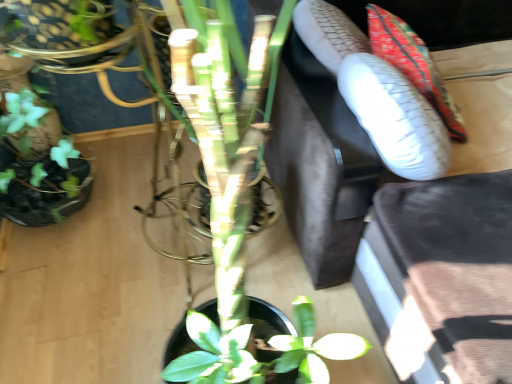
Image resolution: width=512 pixels, height=384 pixels. Describe the element at coordinates (413, 64) in the screenshot. I see `textured fabric cushion at upper right` at that location.

The image size is (512, 384). I want to click on textured fabric cushion at upper right, so 413,64.

Locate an element on the screen. The width and height of the screenshot is (512, 384). velvet dark brown couch at upper right is located at coordinates (320, 165).

This screenshot has width=512, height=384. Describe the element at coordinates (320, 165) in the screenshot. I see `velvet dark brown couch at upper right` at that location.

Find the location of a particular element. This screenshot has height=384, width=512. textured fabric cushion at upper right is located at coordinates (413, 64).

Which object is positioned more to the left, velvet dark brown couch at upper right or textured fabric cushion at upper right?

Positioned to the left is textured fabric cushion at upper right.

Is the position of velvet dark brown couch at upper right less distant than that of textured fabric cushion at upper right?

That is True.

Is point (311, 224) positioned behind point (443, 113)?

That is True.

From the image's perspective, which is below, velvet dark brown couch at upper right or textured fabric cushion at upper right?

velvet dark brown couch at upper right, from the image's perspective.

From a real-world perspective, between velvet dark brown couch at upper right and textured fabric cushion at upper right, who is vertically lower?

velvet dark brown couch at upper right.

Considering the relative sizes of velvet dark brown couch at upper right and textured fabric cushion at upper right in the image provided, is velvet dark brown couch at upper right wider than textured fabric cushion at upper right?

Correct, the width of velvet dark brown couch at upper right exceeds that of textured fabric cushion at upper right.

Does velvet dark brown couch at upper right have a lesser height compared to textured fabric cushion at upper right?

No.

Who is bigger, velvet dark brown couch at upper right or textured fabric cushion at upper right?

With larger size is velvet dark brown couch at upper right.

Would you say velvet dark brown couch at upper right is inside or outside textured fabric cushion at upper right?

velvet dark brown couch at upper right is outside textured fabric cushion at upper right.

Is velvet dark brown couch at upper right positioned far away from textured fabric cushion at upper right?

No, there isn't a large distance between velvet dark brown couch at upper right and textured fabric cushion at upper right.

Based on the photo, is velvet dark brown couch at upper right positioned with its back to textured fabric cushion at upper right?

Yes, textured fabric cushion at upper right is at the back of velvet dark brown couch at upper right.

How different are the orientations of velvet dark brown couch at upper right and textured fabric cushion at upper right in degrees?

They differ by 87 degrees in their facing directions.

Identify the location of couch below the textured fabric cushion at upper right (from a real-world perspective). The image size is (512, 384). (320, 165).

Is textured fabric cushion at upper right to the left or to the right of velvet dark brown couch at upper right in the image?

textured fabric cushion at upper right is positioned on velvet dark brown couch at upper right's left side.

Is textured fabric cushion at upper right in front of or behind velvet dark brown couch at upper right in the image?

textured fabric cushion at upper right is behind velvet dark brown couch at upper right.

Which is in front, point (414, 62) or point (367, 196)?

Point (367, 196)

Consider the image. From the image's perspective, is textured fabric cushion at upper right over velvet dark brown couch at upper right?

Yes, from the image's perspective, textured fabric cushion at upper right is above velvet dark brown couch at upper right.

From a real-world perspective, is textured fabric cushion at upper right positioned over velvet dark brown couch at upper right based on gravity?

Yes, from a real-world perspective, textured fabric cushion at upper right is over velvet dark brown couch at upper right

Can you confirm if textured fabric cushion at upper right is wider than velvet dark brown couch at upper right?

No, textured fabric cushion at upper right is not wider than velvet dark brown couch at upper right.

Based on the photo, is textured fabric cushion at upper right taller or shorter than velvet dark brown couch at upper right?

Considering their sizes, textured fabric cushion at upper right has less height than velvet dark brown couch at upper right.

Which of these two, textured fabric cushion at upper right or velvet dark brown couch at upper right, is smaller?

With smaller size is textured fabric cushion at upper right.

Choose the correct answer: Is textured fabric cushion at upper right inside velvet dark brown couch at upper right or outside it?

textured fabric cushion at upper right lies within the bounds of velvet dark brown couch at upper right.

Does textured fabric cushion at upper right touch velvet dark brown couch at upper right?

No, textured fabric cushion at upper right is not making contact with velvet dark brown couch at upper right.

Could you tell me if textured fabric cushion at upper right is facing velvet dark brown couch at upper right?

Yes, textured fabric cushion at upper right is aimed at velvet dark brown couch at upper right.

At what (x,y) coordinates should I click in order to perform the action: click on couch located on the right of textured fabric cushion at upper right. Please return your answer as a coordinate pair (x, y). The width and height of the screenshot is (512, 384). Looking at the image, I should click on (320, 165).

This screenshot has width=512, height=384. I want to click on flower above the velvet dark brown couch at upper right (from the image's perspective), so click(413, 64).

Where is `couch below the textured fabric cushion at upper right (from the image's perspective)`? The image size is (512, 384). couch below the textured fabric cushion at upper right (from the image's perspective) is located at coordinates (320, 165).